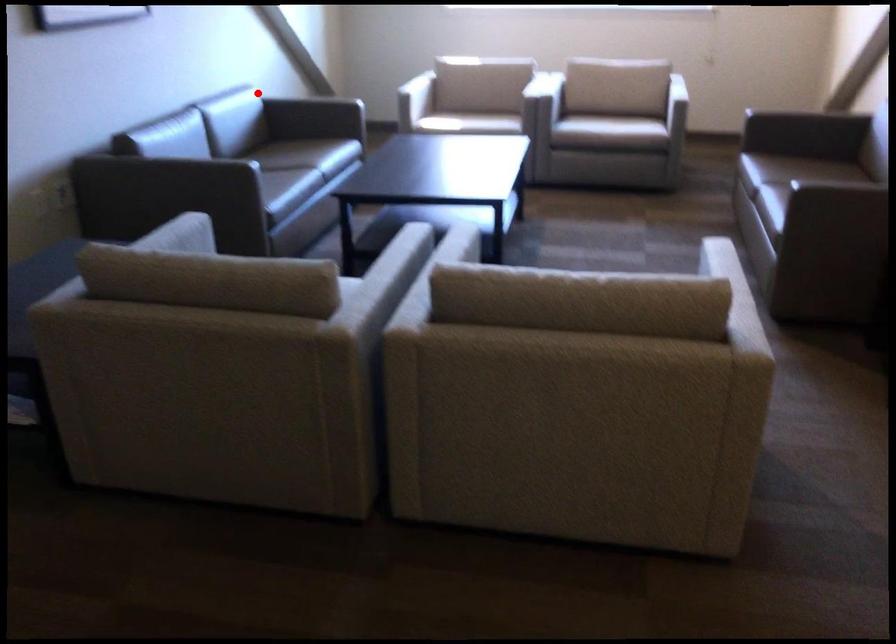
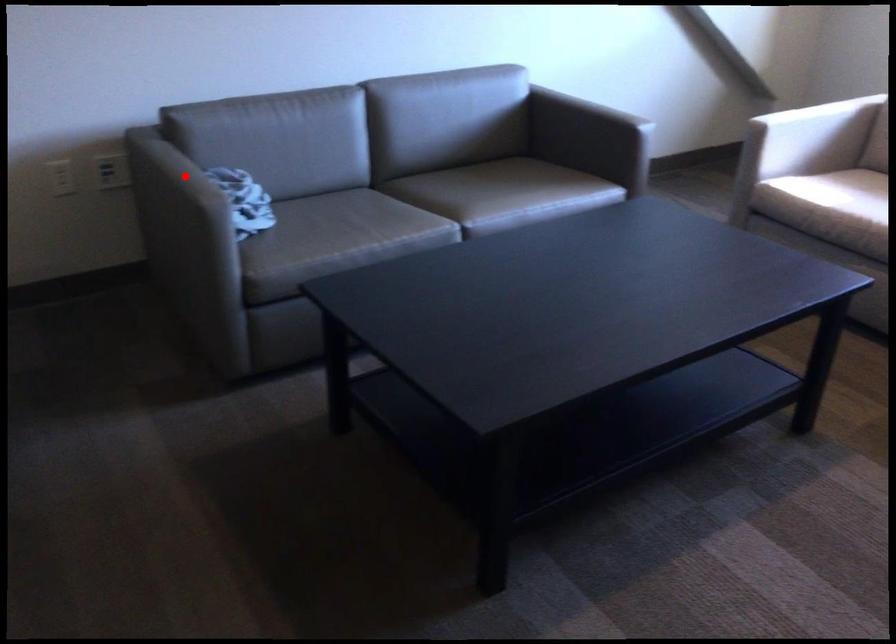
I am providing you with two images of the same scene from different viewpoints. A red point is marked on the first image and another point is marked on the second image. Do the highlighted points in image1 and image2 indicate the same real-world spot?

No